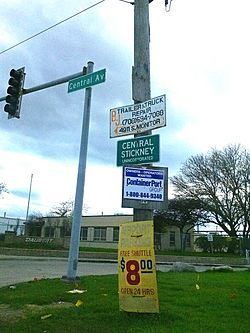
Identify the location of window. This screenshot has height=333, width=250. (95, 232).